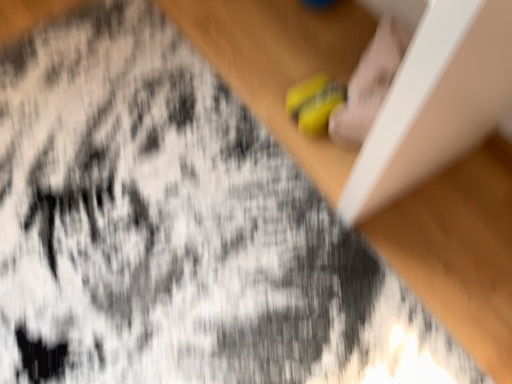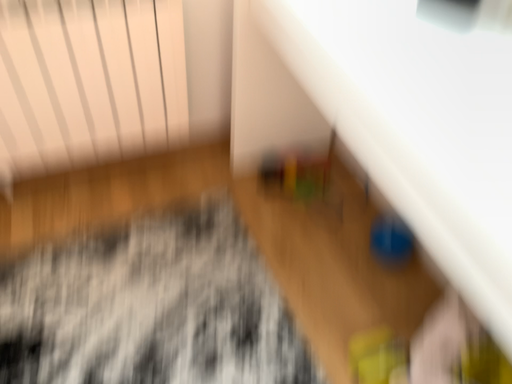
Question: How did the camera likely rotate when shooting the video?

Choices:
 (A) rotated downward
 (B) rotated upward

Answer: (B)